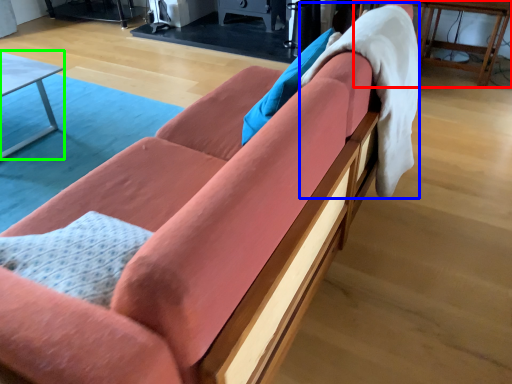
Question: Which object is positioned closest to table (highlighted by a red box)? Select from blanket (highlighted by a blue box) and table (highlighted by a green box).

Choices:
 (A) blanket
 (B) table

Answer: (A)